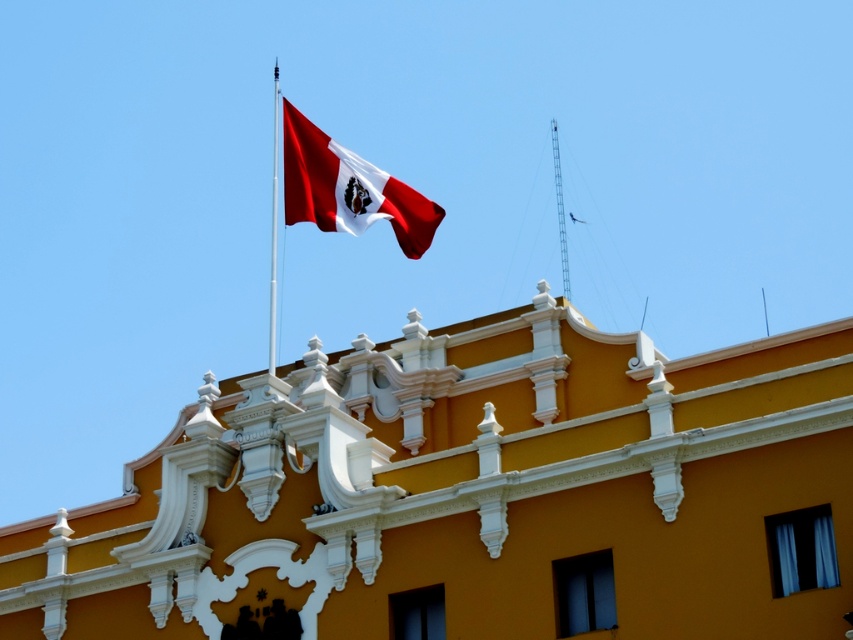
Between point (94, 577) and point (556, 129), which one is positioned behind?

The point (556, 129) is more distant.

Is point (230, 593) positioned in front of point (556, 182)?

Yes, it is.

Identify the location of matte orange building at center. The width and height of the screenshot is (853, 640). (474, 496).

Between metallic flag pole at upper center and metallic tower at upper center, which one has less height?

metallic tower at upper center

Image resolution: width=853 pixels, height=640 pixels. I want to click on metallic flag pole at upper center, so (273, 225).

Who is more forward, (369, 179) or (277, 134)?

Point (369, 179) is more forward.

Is point (317, 189) less distant than point (276, 227)?

Yes, it is.

Is point (396, 196) positioned in front of point (274, 298)?

Yes.

You are a GUI agent. You are given a task and a screenshot of the screen. Output one action in this format:
    pyautogui.click(x=<x>, y=<y>)
    Task: Click on the matte red flag at upper center
    This screenshot has width=853, height=640.
    Given the screenshot: What is the action you would take?
    pyautogui.click(x=347, y=188)